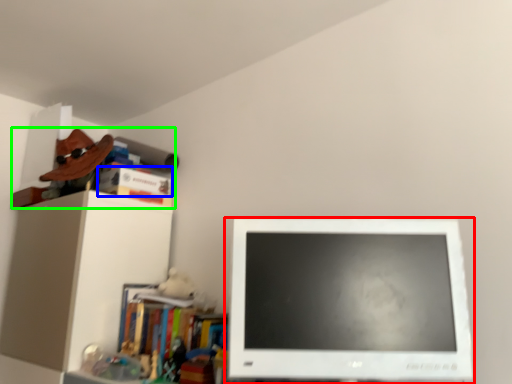
Question: Based on their relative distances, which object is nearer to computer monitor (highlighted by a red box)? Choose from book (highlighted by a blue box) and book (highlighted by a green box).

Choices:
 (A) book
 (B) book

Answer: (B)